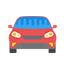
The image size is (64, 68). Identify the location of lights. (49, 34).